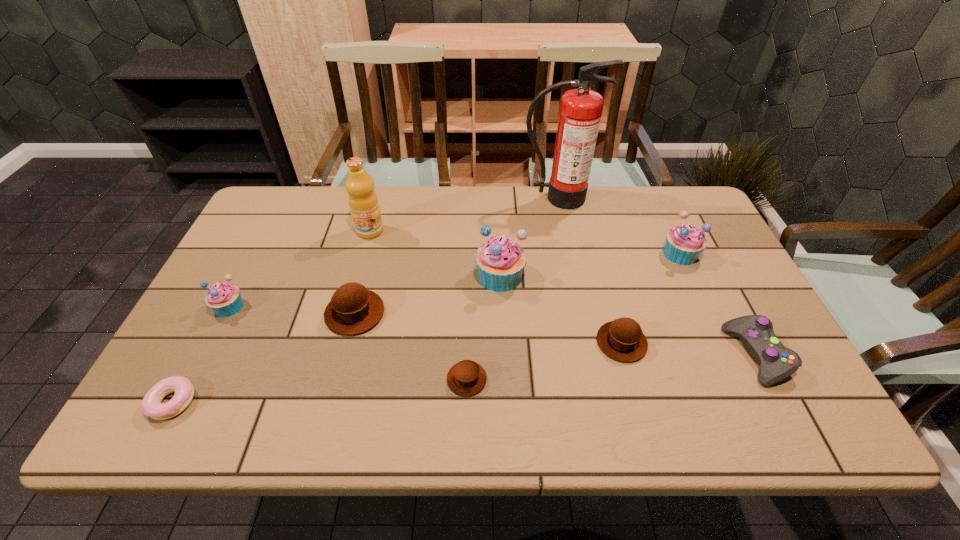
Identify the location of vacant area located 0.270m on the front label of the fruit juice. (349, 310).

At what (x,y) coordinates should I click in order to perform the action: click on vacant position located on the right of the third tallest object. Please return your answer as a coordinate pair (x, y). Looking at the image, I should click on (635, 276).

This screenshot has width=960, height=540. Identify the location of free space located 0.140m on the front of the second smallest blue muffin. (704, 306).

Identify the location of free location located on the front of the leftmost muffin. (198, 367).

Locate an element on the screen. This screenshot has width=960, height=540. free space located on the back of the leftmost brown muffin is located at coordinates (372, 248).

Identify the location of free location located on the left of the second biggest brown muffin. (534, 342).

Where is `free space located 0.310m on the back of the control`? The width and height of the screenshot is (960, 540). free space located 0.310m on the back of the control is located at coordinates (699, 242).

At what (x,y) coordinates should I click in order to perform the action: click on free space located on the left of the second shortest object. Please return your answer as a coordinate pair (x, y). This screenshot has height=540, width=960. Looking at the image, I should click on (344, 379).

Where is `free space located 0.280m on the back of the doughnut`? This screenshot has height=540, width=960. free space located 0.280m on the back of the doughnut is located at coordinates (232, 289).

Identify the location of fire extinguisher at the far edge. Image resolution: width=960 pixels, height=540 pixels. (580, 113).